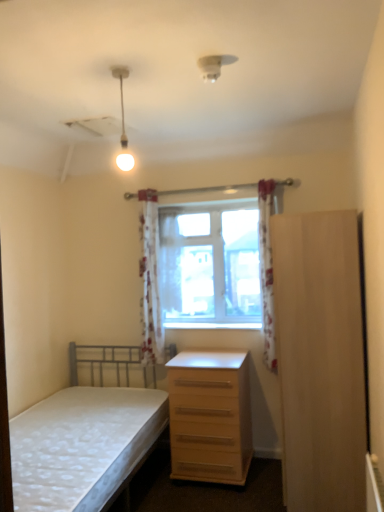
Locate an element on the screen. The width and height of the screenshot is (384, 512). vacant space situated above wooden at center (from a real-world perspective) is located at coordinates (203, 325).